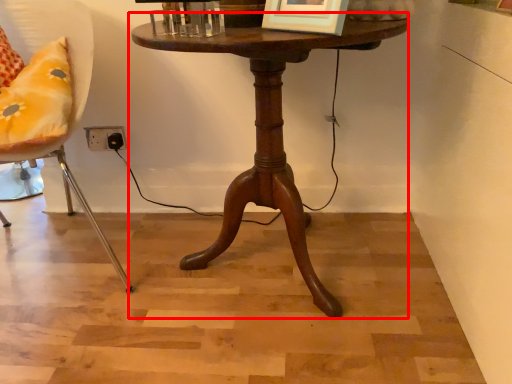
Question: From the image's perspective, what is the correct spatial relationship of table (annotated by the red box) in relation to chair?

Choices:
 (A) below
 (B) above

Answer: (A)